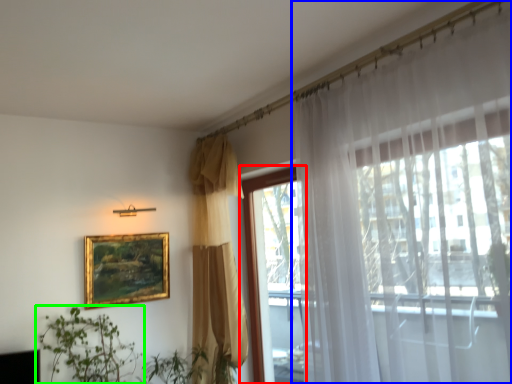
Question: Estimate the real-world distances between objects in this image. Which object is closer to window (highlighted by a red box), curtain (highlighted by a blue box) or houseplant (highlighted by a green box)?

Choices:
 (A) curtain
 (B) houseplant

Answer: (B)